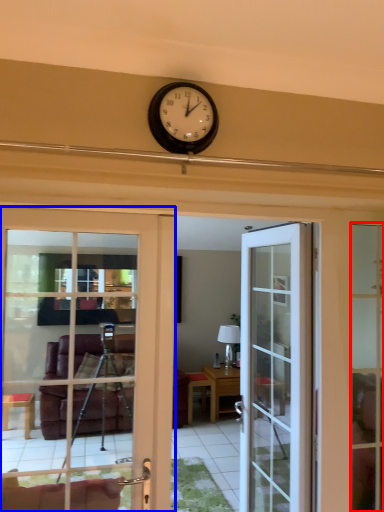
Question: Which point is further to the camera, window frame (highlighted by a red box) or door (highlighted by a blue box)?

Choices:
 (A) window frame
 (B) door

Answer: (A)